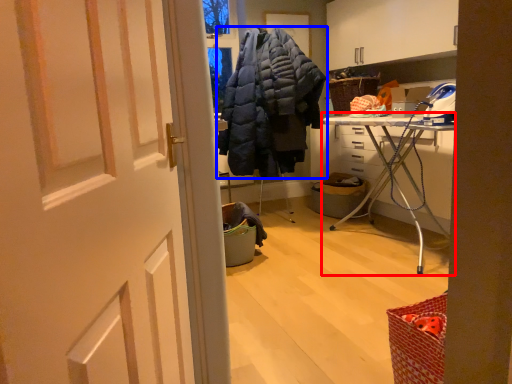
Question: Among these objects, which one is nearest to the camera, furniture (highlighted by a red box) or jacket (highlighted by a blue box)?

Choices:
 (A) furniture
 (B) jacket

Answer: (A)